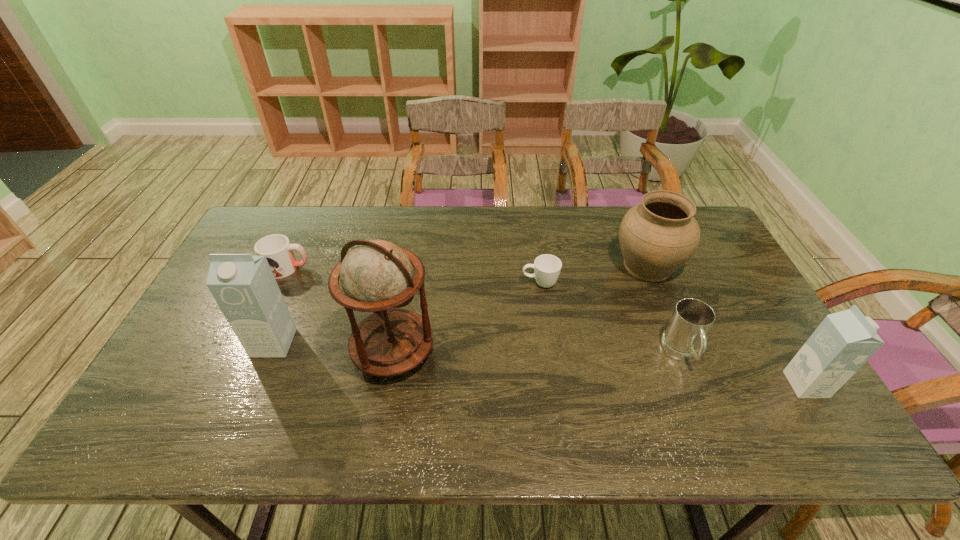
Where is `the fourth object from left to right`? The width and height of the screenshot is (960, 540). the fourth object from left to right is located at coordinates (547, 267).

Where is `globe`? Image resolution: width=960 pixels, height=540 pixels. globe is located at coordinates (376, 276).

I want to click on the fifth object from right to left, so click(376, 276).

Where is `free space located on the front label of the farther carton`? This screenshot has width=960, height=540. free space located on the front label of the farther carton is located at coordinates (260, 374).

The width and height of the screenshot is (960, 540). What are the coordinates of `vacant region located on the side of the sixth tallest object with the handle` in the screenshot? It's located at (361, 268).

In order to click on free location located on the left of the urn in this screenshot , I will do `click(489, 266)`.

Identify the location of free space located 0.060m on the side of the right mug with the handle. This screenshot has height=540, width=960. (699, 396).

Find the location of a particular element. The image size is (960, 540). vacant space located with the handle on the side of the shortest object is located at coordinates (396, 283).

You are a GUI agent. You are given a task and a screenshot of the screen. Output one action in this format:
    pyautogui.click(x=<x>, y=<y>)
    Task: Click on the blank space located with the handle on the side of the shortest object
    This screenshot has width=960, height=540.
    Given the screenshot: What is the action you would take?
    pyautogui.click(x=466, y=283)

You are a GUI agent. You are given a task and a screenshot of the screen. Output one action in this format:
    pyautogui.click(x=<x>, y=<y>)
    Task: Click on the blank space located with the handle on the side of the shortest object
    
    Given the screenshot: What is the action you would take?
    pyautogui.click(x=390, y=283)